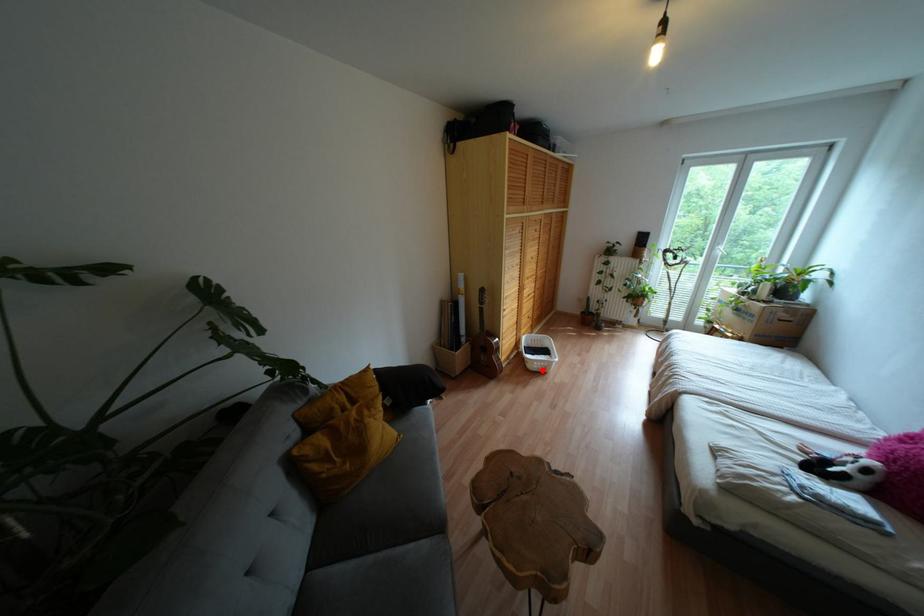
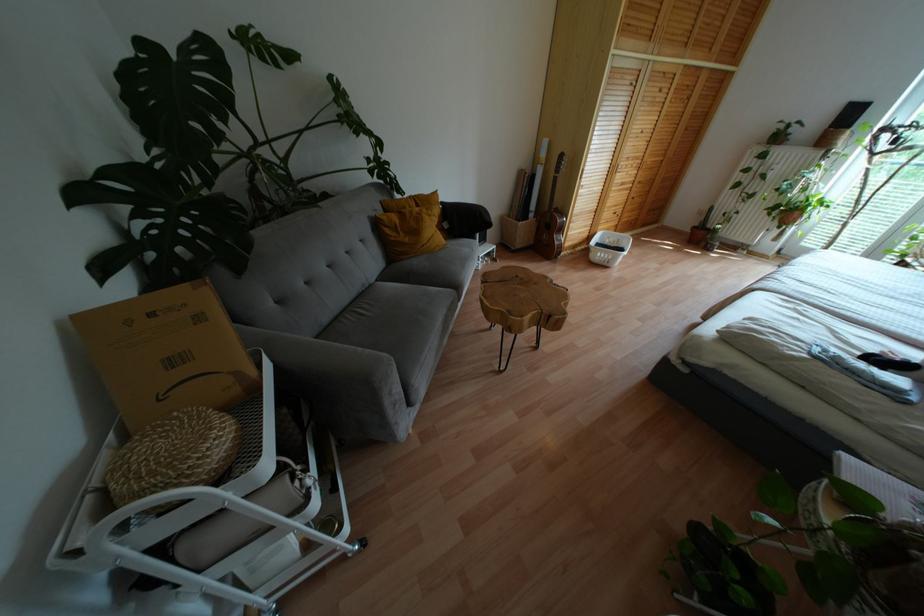
The point at the highlighted location is marked in the first image. Where is the corresponding point in the second image?

(604, 262)